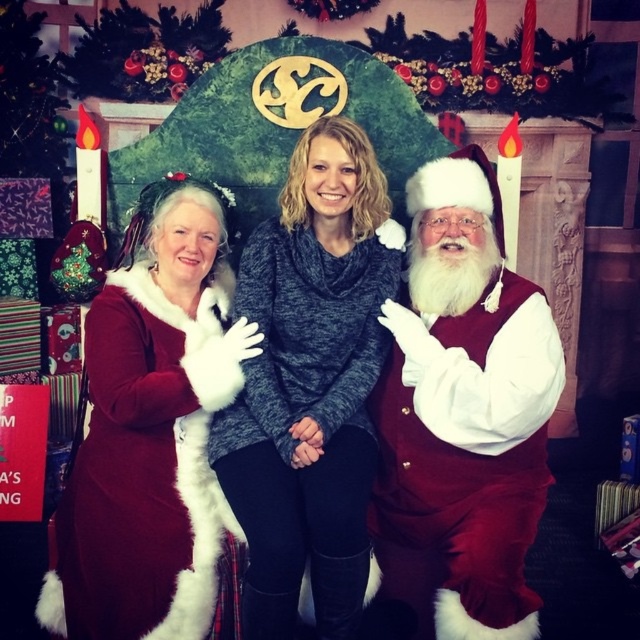
You are standing in front of the festive scene and want to place a small gift box exactly halfway between point [472,291] and point [349,550]. Will the gift box be closer to the older woman in the Santa Claus outfit or the younger woman in the dark gray sweater?

The gift box placed halfway between point [472,291] and point [349,550] will be closer to the younger woman in the dark gray sweater because point [472,291] is closer to the older woman and point [349,550] is closer to the younger woman. The midpoint would lean towards the younger woman due to the positioning of the points.

Based on the festive scene described, which clothing item is positioned higher on the person wearing both the gray sweater at center and the velvet red coat at center?

The gray sweater at center is positioned above the velvet red coat at center, so the gray sweater is higher.